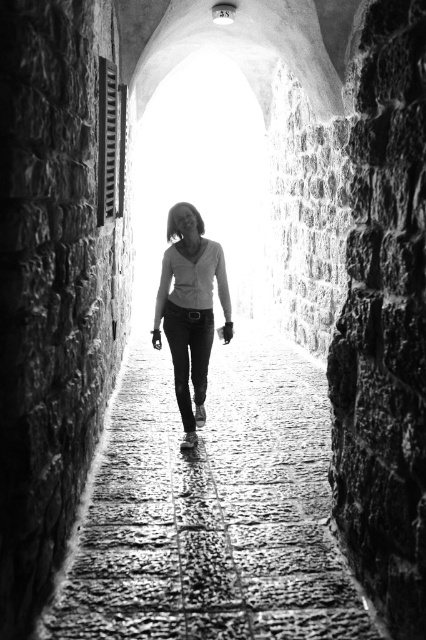
Question: Can you confirm if smooth stone path at center is bigger than matte white blouse at center?

Choices:
 (A) yes
 (B) no

Answer: (B)

Question: Does smooth stone path at center appear under matte white blouse at center?

Choices:
 (A) yes
 (B) no

Answer: (A)

Question: Which point appears closest to the camera in this image?

Choices:
 (A) (203, 257)
 (B) (199, 538)

Answer: (B)

Question: Which point is closer to the camera?

Choices:
 (A) matte white blouse at center
 (B) smooth stone path at center

Answer: (B)

Question: Does smooth stone path at center appear over matte white blouse at center?

Choices:
 (A) yes
 (B) no

Answer: (B)